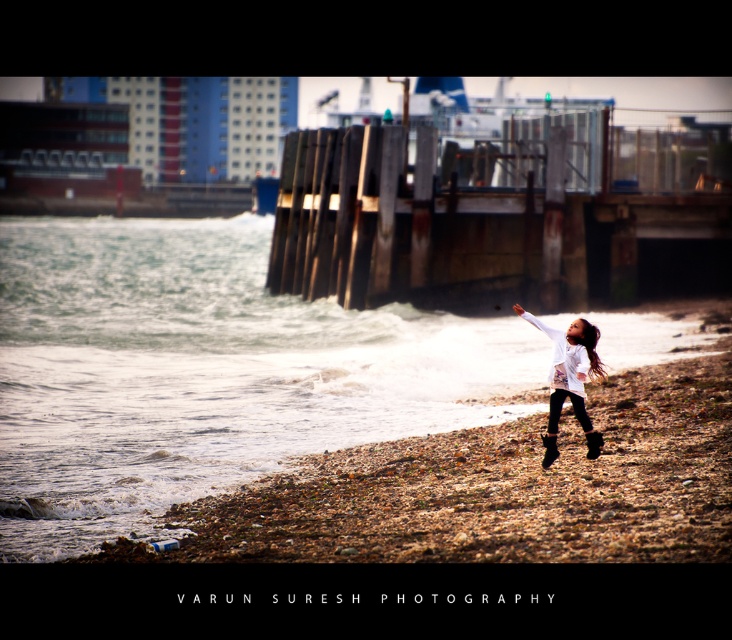
You are standing at the point marked by coordinates point (493, 218) in the image. What object are you standing on?

You are standing on the rusty wood dock at center marked by point (493, 218).

You are standing on the white matte jacket at lower right and want to walk to the rusty wood dock at center. Which direction should you move to reach it?

The rusty wood dock at center is to the right of the white matte jacket at lower right, so you should move to the right to reach it.